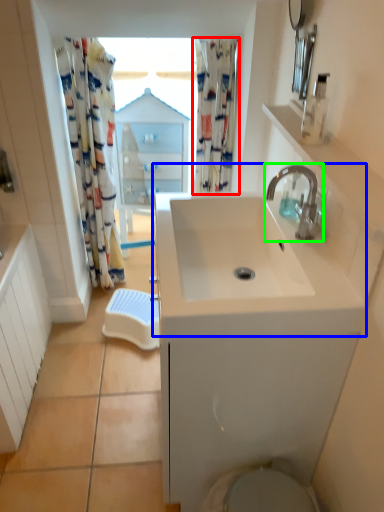
Question: Based on their relative distances, which object is nearer to shower curtain (highlighted by a red box)? Choose from sink (highlighted by a blue box) and tap (highlighted by a green box).

Choices:
 (A) sink
 (B) tap

Answer: (B)